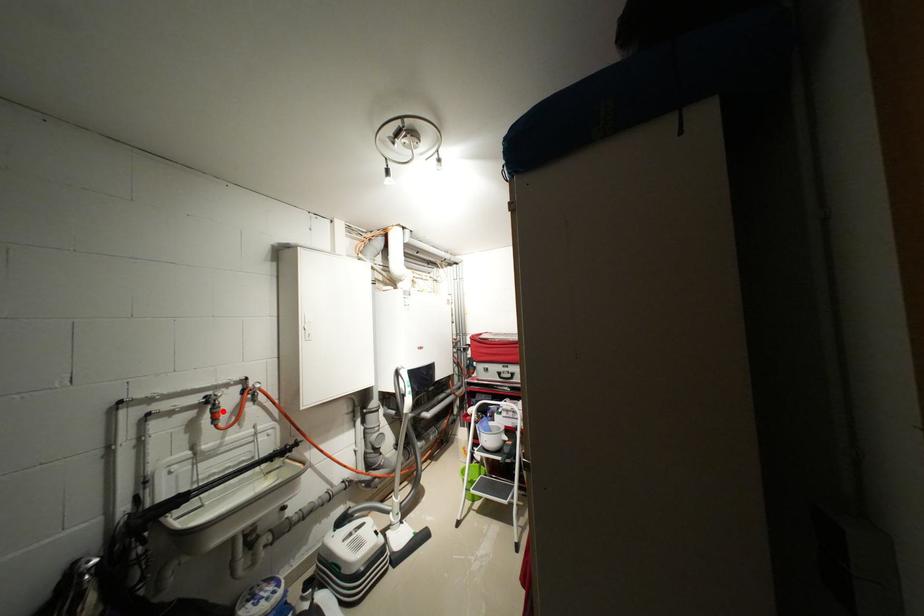
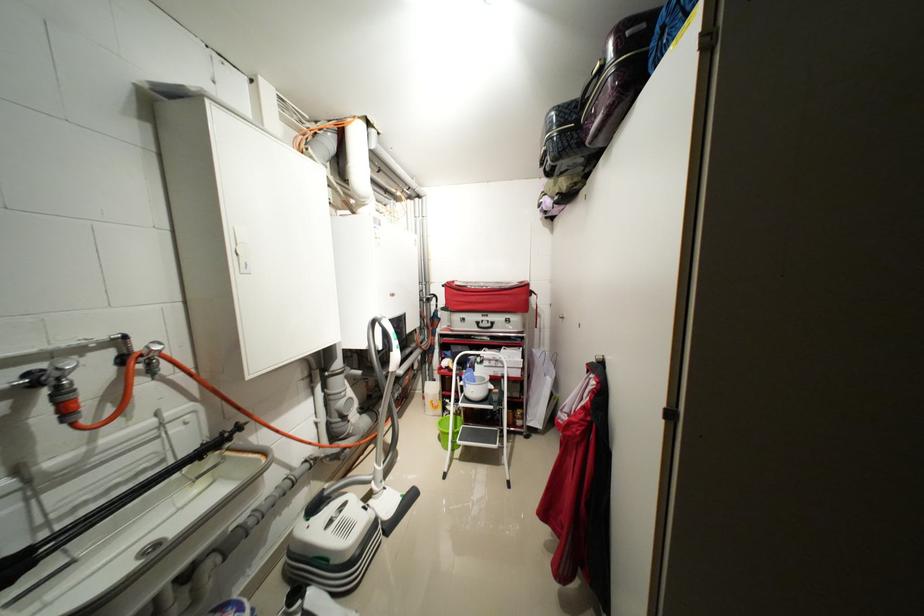
Where in the second image is the point corresponding to the highlighted location from the first image?

(71, 399)